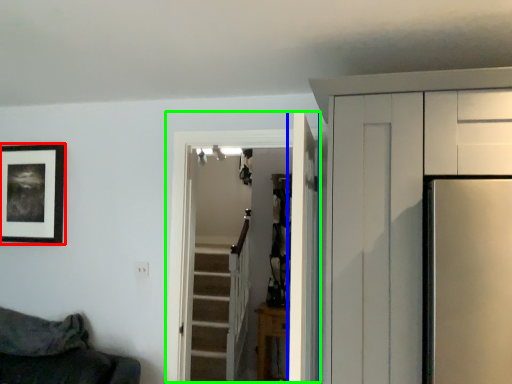
Question: Which object is positioned closest to picture frame (highlighted by a red box)? Select from door (highlighted by a blue box) and door (highlighted by a green box).

Choices:
 (A) door
 (B) door

Answer: (B)